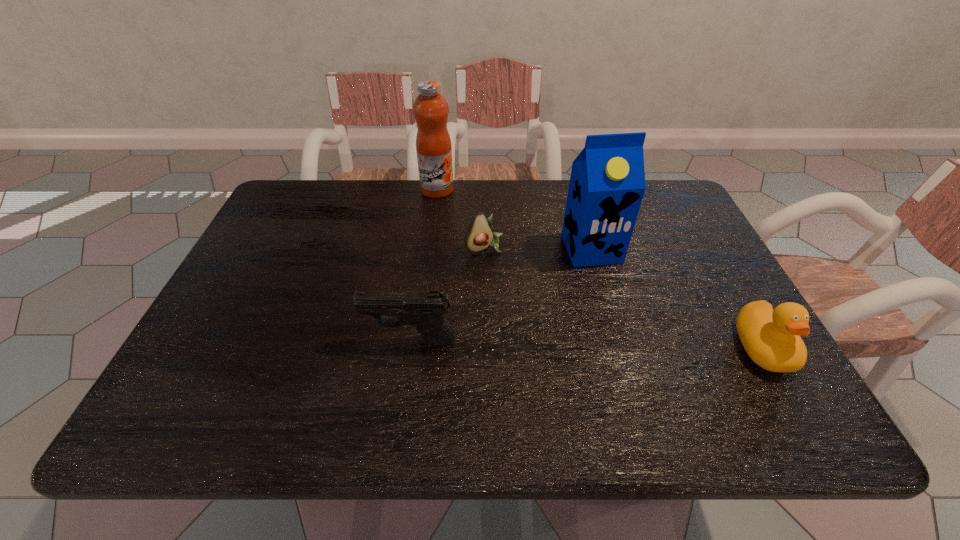
The image size is (960, 540). I want to click on free region located 0.230m on the front label of the farthest object, so click(x=471, y=241).

Where is `vacant space positioned with the cap open on the second object from right to left`? This screenshot has width=960, height=540. vacant space positioned with the cap open on the second object from right to left is located at coordinates (632, 338).

Where is `vacant space located with the cap open on the second object from right to left`? This screenshot has height=540, width=960. vacant space located with the cap open on the second object from right to left is located at coordinates (612, 295).

Where is `vacant region located 0.110m with the cap open on the second object from right to left`? The width and height of the screenshot is (960, 540). vacant region located 0.110m with the cap open on the second object from right to left is located at coordinates [614, 298].

Find the location of a particular element. This screenshot has height=540, width=960. vacant space located on the seed side of the avocado is located at coordinates (549, 335).

Image resolution: width=960 pixels, height=540 pixels. What are the coordinates of `vacant space located 0.180m on the seed side of the avocado` in the screenshot? It's located at (525, 302).

Locate an element on the screen. vacant space located 0.380m on the seed side of the avocado is located at coordinates (571, 367).

The image size is (960, 540). I want to click on object that is at the far edge, so click(x=430, y=109).

You are a GUI agent. You are given a task and a screenshot of the screen. Output one action in this format:
    pyautogui.click(x=<x>, y=<y>)
    Task: Click on the object present at the near edge
    This screenshot has width=960, height=540.
    Given the screenshot: What is the action you would take?
    pyautogui.click(x=771, y=338)

Where is `object that is at the right edge`? The width and height of the screenshot is (960, 540). object that is at the right edge is located at coordinates (771, 338).